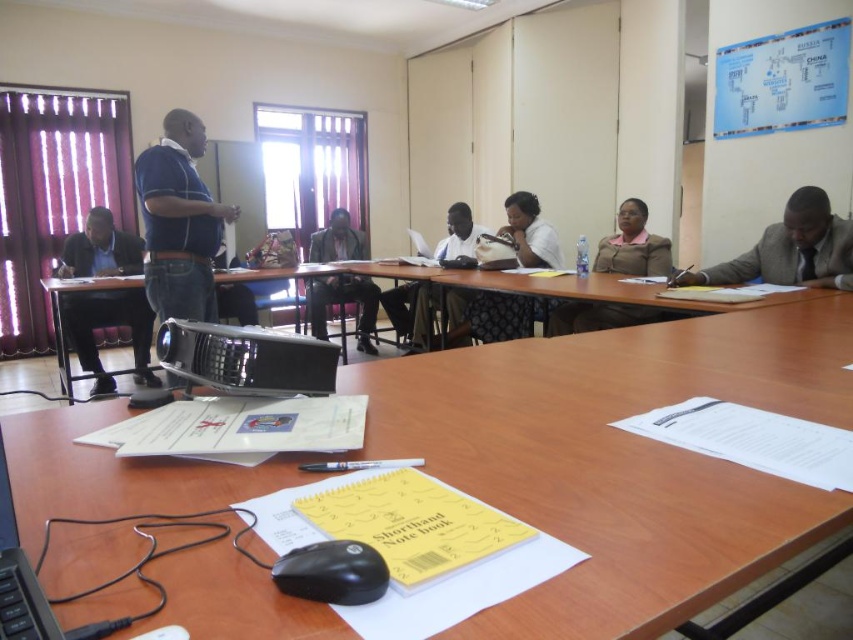
You are a guest entering the meeting room and need to sit down. There is a matte black suit at left and a black plastic keyboard at lower left. Which object should you avoid stepping over to reach the seat?

You should avoid stepping over the black plastic keyboard at lower left because it is behind the matte black suit at left, meaning it is in your path to the seat.

You are setting up a presentation and need to place both the black plastic mouse at lower center and the black plastic keyboard at lower left on the table. If the space available is only enough for an object that is 15 centimeters wide, which one can you place first?

The black plastic mouse at lower center has a smaller width than the black plastic keyboard at lower left, so you can place the black plastic mouse at lower center first since it is narrower and fits within the 15 cm space.

You are organizing a conference and need to ensure that the matte black suit at left and the black plastic keyboard at lower left can fit side by side on a 1.2 meter wide table. Based on their widths, will they both fit?

The matte black suit at left is wider than the black plastic keyboard at lower left. However, without knowing their exact widths, we can only confirm that together they would require more than the keyboard alone. If the total width of both items combined is less than or equal to 1.2 meters, they can fit. Since the exact widths aren